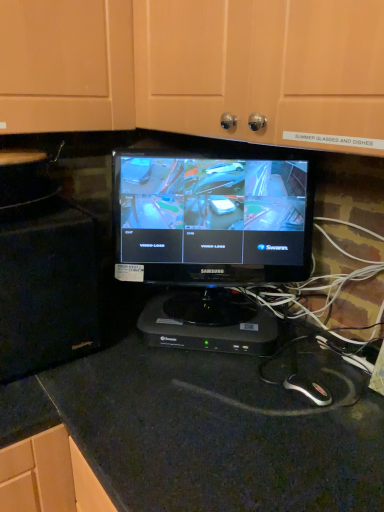
In order to click on vacant space situated above black granite countertop at center (from a real-world perspective) in this screenshot , I will do `click(245, 424)`.